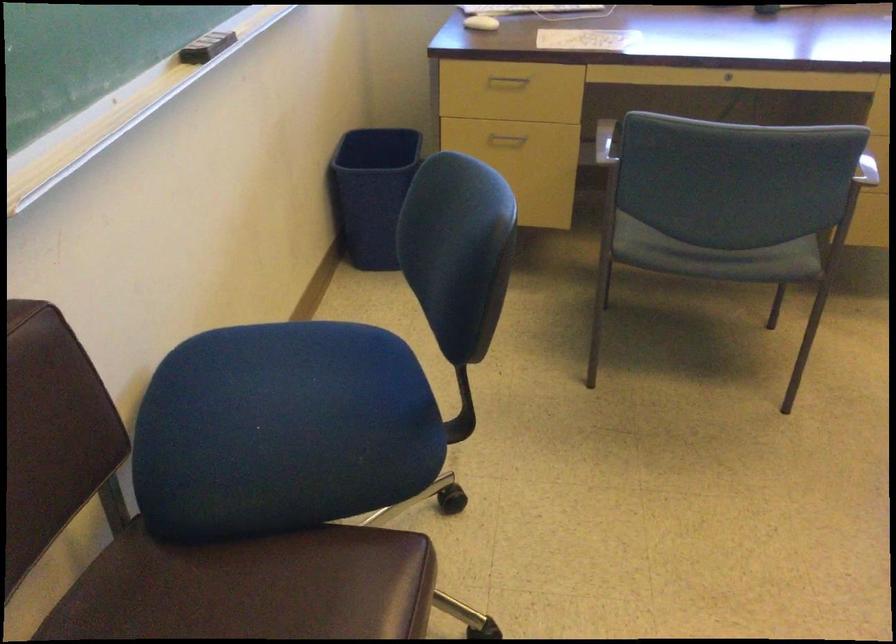
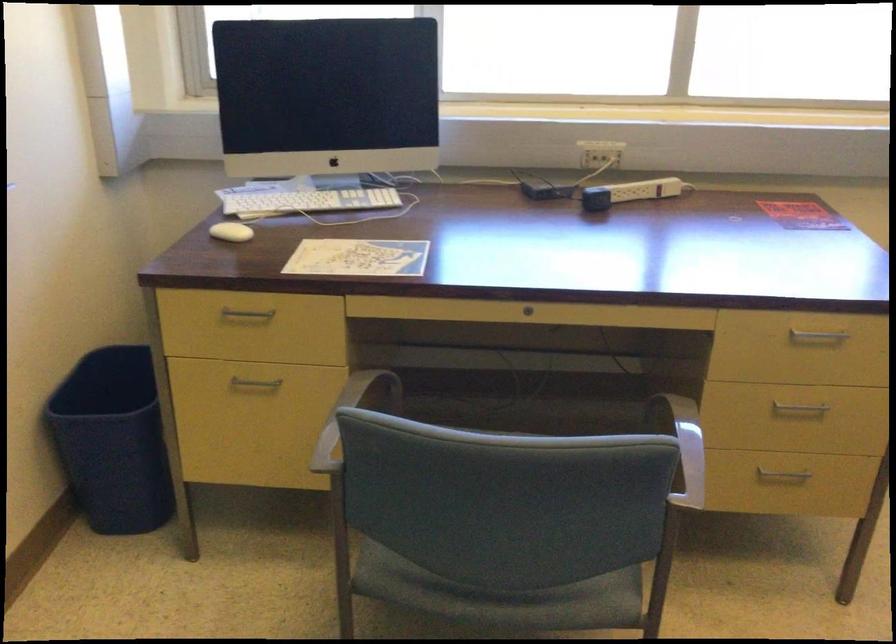
Locate, in the second image, the point that corresponds to [719,257] in the first image.

(502, 597)